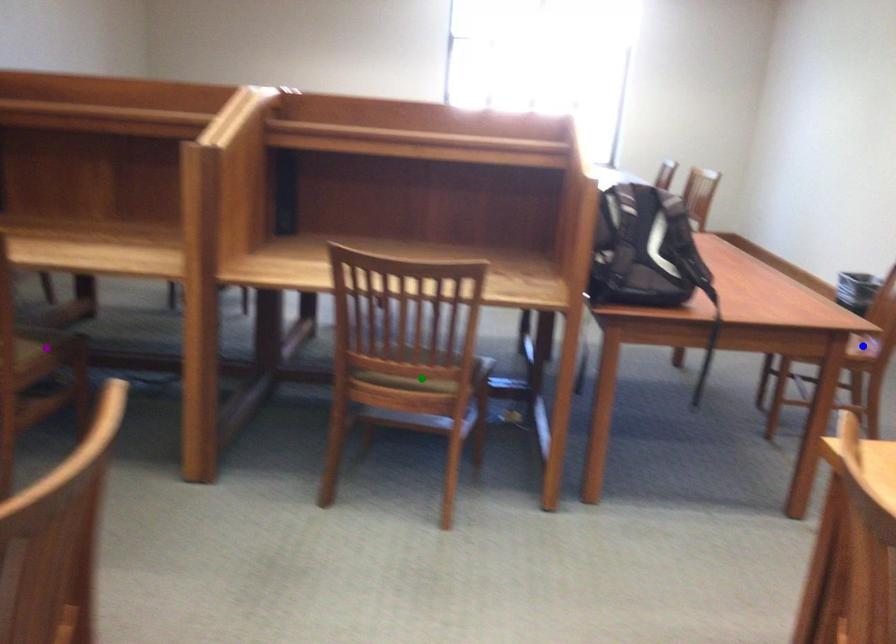
Order these from nearest to farthest:
A) purple point
B) blue point
C) green point

green point < purple point < blue point